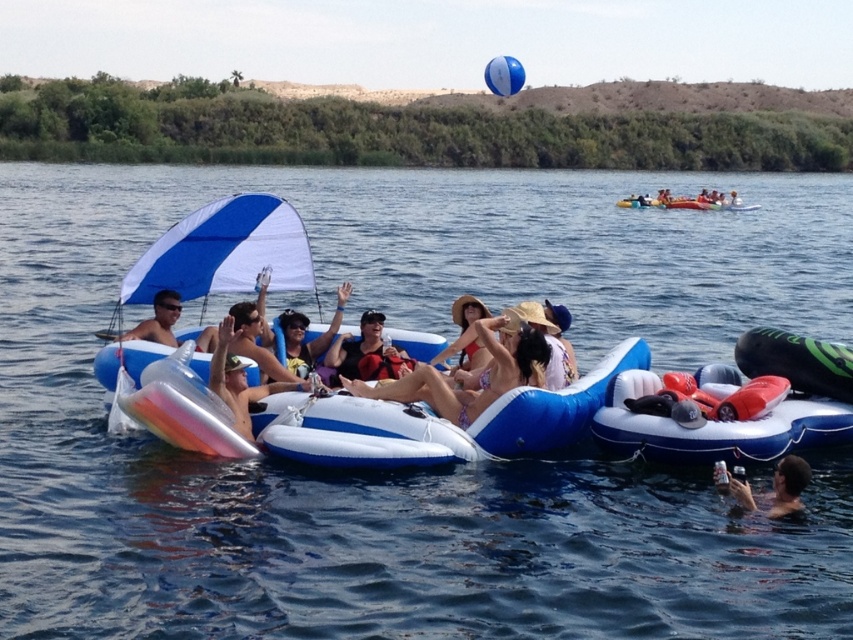
You are a photographer taking a picture of the pink bikini at center and the blue rubber balloon at upper center. Which object should you focus on first if you want to capture both in the same frame without moving the camera?

The pink bikini at center is located below the blue rubber balloon at upper center, so you should focus on the blue rubber balloon at upper center first to ensure both are in the frame.

You are a photographer trying to capture the pink bikini at center in the image. The raft is at point (480, 372). Where should you position your camera to ensure the pink bikini at center is in the frame?

The pink bikini at center is located at point (480, 372), so you should position your camera at the center of the image to capture it.